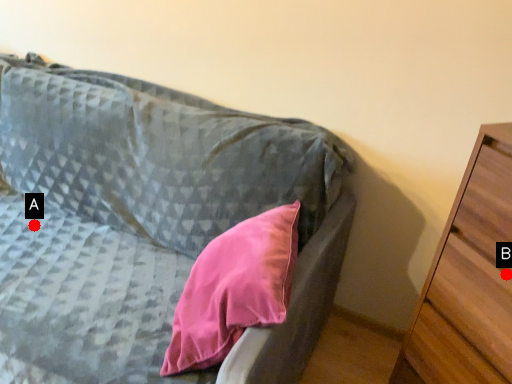
Question: Two points are circled on the image, labeled by A and B beside each circle. Which point is closer to the camera taking this photo?

Choices:
 (A) A is closer
 (B) B is closer

Answer: (B)